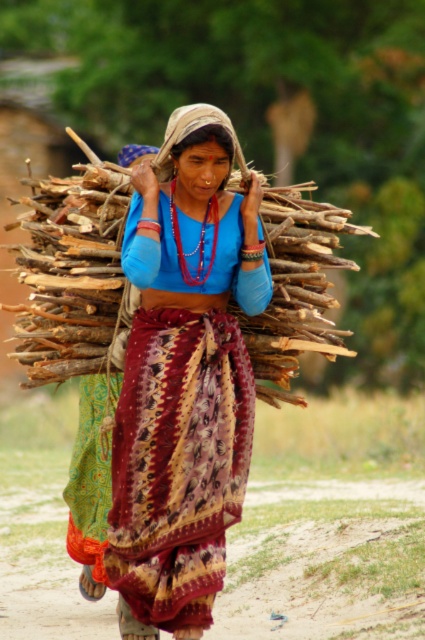
Question: Which point appears farthest from the camera in this image?

Choices:
 (A) (248, 202)
 (B) (231, 140)
 (C) (204, 154)

Answer: (A)

Question: Which is nearer to the matte blue blouse at center?

Choices:
 (A) matte blue shirt at center
 (B) matte blue fabric at center
 (C) wooden sticks at center

Answer: (B)

Question: Does wooden sticks at center appear under matte blue fabric at center?

Choices:
 (A) no
 (B) yes

Answer: (B)

Question: Is matte blue blouse at center wider than matte blue fabric at center?

Choices:
 (A) yes
 (B) no

Answer: (A)

Question: Can you confirm if matte blue blouse at center is wider than matte blue shirt at center?

Choices:
 (A) no
 (B) yes

Answer: (B)

Question: Estimate the real-world distances between objects in this image. Which object is farther from the matte blue fabric at center?

Choices:
 (A) wooden sticks at center
 (B) matte blue blouse at center

Answer: (A)